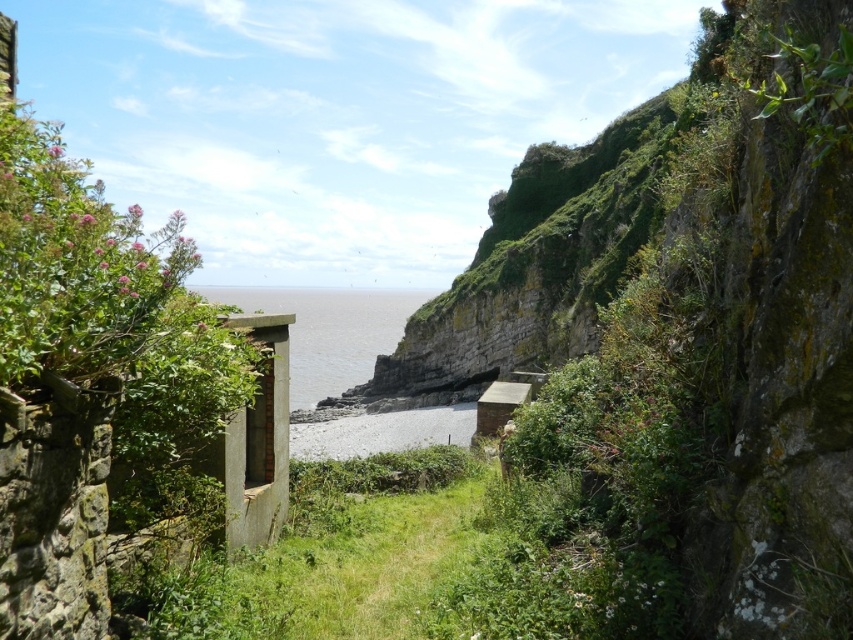
You are a hiker who wants to cross from the rocky shoreline to the pebbled beach. You see the clear blue water at center and the gray gravel at center. Which path is higher and safer to walk on?

The clear blue water at center has a greater height compared to gray gravel at center, so the clear blue water at center is higher and safer to walk on.

You are a hiker who wants to cross from the left stone structure to the right cliff. You need to know which path is wider between the clear blue water at center and the gray gravel at center. Which one should you choose?

The clear blue water at center is wider than the gray gravel at center, so you should choose the clear blue water at center path.